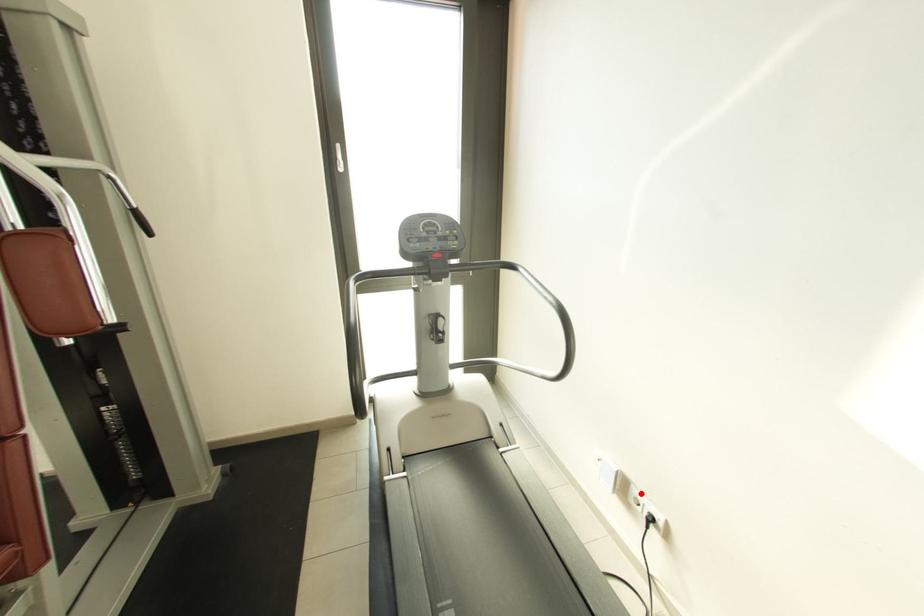
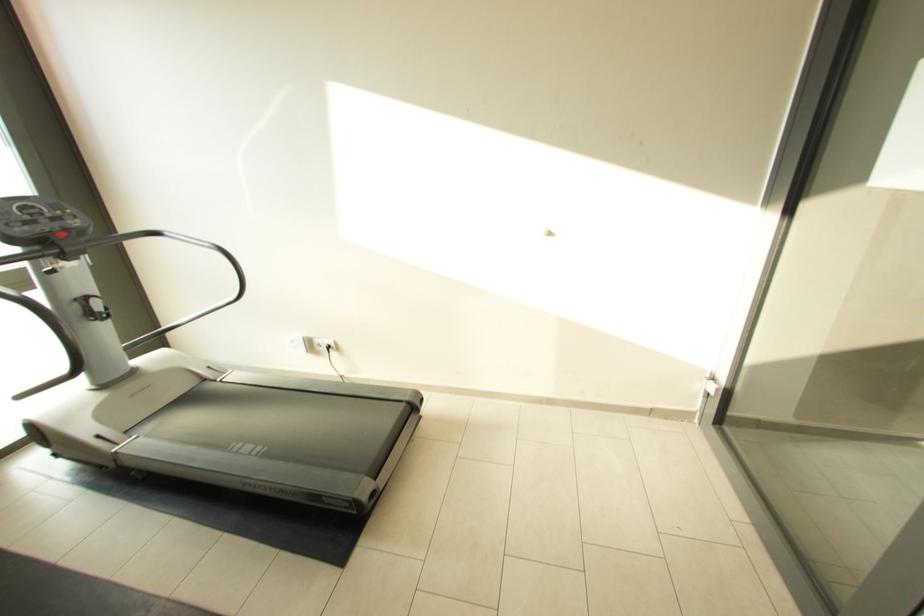
Where in the second image is the point corresponding to the highlighted location from the first image?

(322, 342)